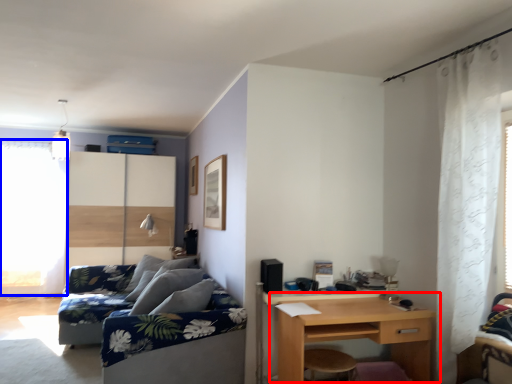
Question: Which object appears farthest to the camera in this image, desk (highlighted by a red box) or window screen (highlighted by a blue box)?

Choices:
 (A) desk
 (B) window screen

Answer: (B)